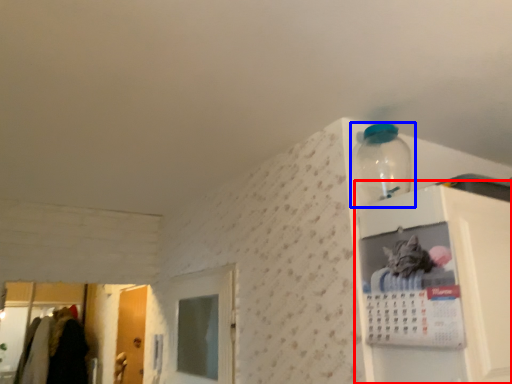
Question: Which object appears farthest to the camera in this image, cabinet (highlighted by a red box) or bottle (highlighted by a blue box)?

Choices:
 (A) cabinet
 (B) bottle

Answer: (B)